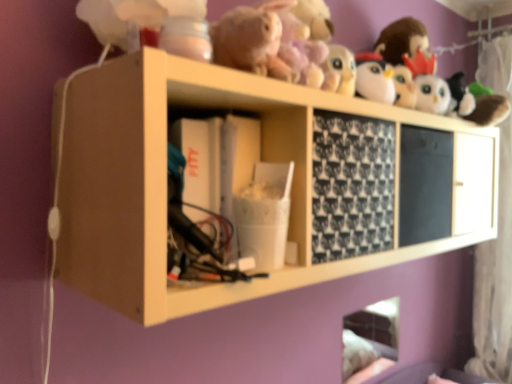
What do you see at coordinates (495, 282) in the screenshot? This screenshot has width=512, height=384. I see `white sheer curtain at right` at bounding box center [495, 282].

Where is `white sheer curtain at right`? This screenshot has width=512, height=384. white sheer curtain at right is located at coordinates (495, 282).

You are a GUI agent. You are given a task and a screenshot of the screen. Output one action in this format:
    pyautogui.click(x=<x>, y=<y>)
    Task: Click on the wooden shelf at upper center
    The image size is (512, 384).
    Given the screenshot: What is the action you would take?
    pyautogui.click(x=244, y=179)

The width and height of the screenshot is (512, 384). Describe the element at coordinates (244, 179) in the screenshot. I see `wooden shelf at upper center` at that location.

The height and width of the screenshot is (384, 512). I want to click on white sheer curtain at right, so click(x=495, y=282).

Does wooden shelf at upper center appear on the right side of white sheer curtain at right?

No, wooden shelf at upper center is not to the right of white sheer curtain at right.

Consider the image. Is wooden shelf at upper center in front of or behind white sheer curtain at right in the image?

In the image, wooden shelf at upper center appears in front of white sheer curtain at right.

Which is in front, point (138, 91) or point (485, 248)?

The point (138, 91) is in front.

In the scene shown: From the image's perspective, relative to white sheer curtain at right, is wooden shelf at upper center above or below?

From the image's perspective, wooden shelf at upper center appears above white sheer curtain at right.

From a real-world perspective, which object stands above the other?

wooden shelf at upper center.

Can you confirm if wooden shelf at upper center is wider than white sheer curtain at right?

Yes, wooden shelf at upper center is wider than white sheer curtain at right.

Considering the sizes of wooden shelf at upper center and white sheer curtain at right in the image, is wooden shelf at upper center taller or shorter than white sheer curtain at right?

Clearly, wooden shelf at upper center is shorter compared to white sheer curtain at right.

Considering the relative sizes of wooden shelf at upper center and white sheer curtain at right in the image provided, is wooden shelf at upper center smaller than white sheer curtain at right?

No.

Do you think wooden shelf at upper center is within white sheer curtain at right, or outside of it?

wooden shelf at upper center is outside white sheer curtain at right.

From the picture: Can you see wooden shelf at upper center touching white sheer curtain at right?

No, wooden shelf at upper center is not next to white sheer curtain at right.

Looking at this image, is wooden shelf at upper center looking in the opposite direction of white sheer curtain at right?

That's not correct — wooden shelf at upper center is not looking away from white sheer curtain at right.

Can you tell me how much wooden shelf at upper center and white sheer curtain at right differ in facing direction?

They differ by 90 degrees in their facing directions.

Where is `shelf in front of the white sheer curtain at right`? The height and width of the screenshot is (384, 512). shelf in front of the white sheer curtain at right is located at coordinates (244, 179).

Visually, is white sheer curtain at right positioned to the left or to the right of wooden shelf at upper center?

From the image, it's evident that white sheer curtain at right is to the right of wooden shelf at upper center.

Considering the positions of objects white sheer curtain at right and wooden shelf at upper center in the image provided, who is behind, white sheer curtain at right or wooden shelf at upper center?

white sheer curtain at right.

Considering the positions of points (509, 221) and (64, 246), is point (509, 221) farther from camera compared to point (64, 246)?

Yes, point (509, 221) is farther from viewer.

Looking at this image, from the image's perspective, which is below, white sheer curtain at right or wooden shelf at upper center?

white sheer curtain at right appears lower in the image.

From a real-world perspective, which is physically above, white sheer curtain at right or wooden shelf at upper center?

From a 3D spatial view, wooden shelf at upper center is above.

In the scene shown: Does white sheer curtain at right have a lesser width compared to wooden shelf at upper center?

Yes.

Does white sheer curtain at right have a greater height compared to wooden shelf at upper center?

Correct, white sheer curtain at right is much taller as wooden shelf at upper center.

Does white sheer curtain at right have a smaller size compared to wooden shelf at upper center?

Correct, white sheer curtain at right occupies less space than wooden shelf at upper center.

Is white sheer curtain at right spatially inside wooden shelf at upper center, or outside of it?

white sheer curtain at right is spatially situated outside wooden shelf at upper center.

Are white sheer curtain at right and wooden shelf at upper center beside each other?

No, white sheer curtain at right is not beside wooden shelf at upper center.

Is white sheer curtain at right oriented towards wooden shelf at upper center?

Yes, white sheer curtain at right is facing wooden shelf at upper center.

How different are the orientations of white sheer curtain at right and wooden shelf at upper center in degrees?

They differ by 90 degrees in their facing directions.

Identify the location of shelf located on the left of white sheer curtain at right. (244, 179).

Locate an element on the screen. The image size is (512, 384). curtain behind the wooden shelf at upper center is located at coordinates (x=495, y=282).

You are a GUI agent. You are given a task and a screenshot of the screen. Output one action in this format:
    pyautogui.click(x=<x>, y=<y>)
    Task: Click on the shelf that appears above the white sheer curtain at right (from the image's perspective)
    
    Given the screenshot: What is the action you would take?
    pyautogui.click(x=244, y=179)